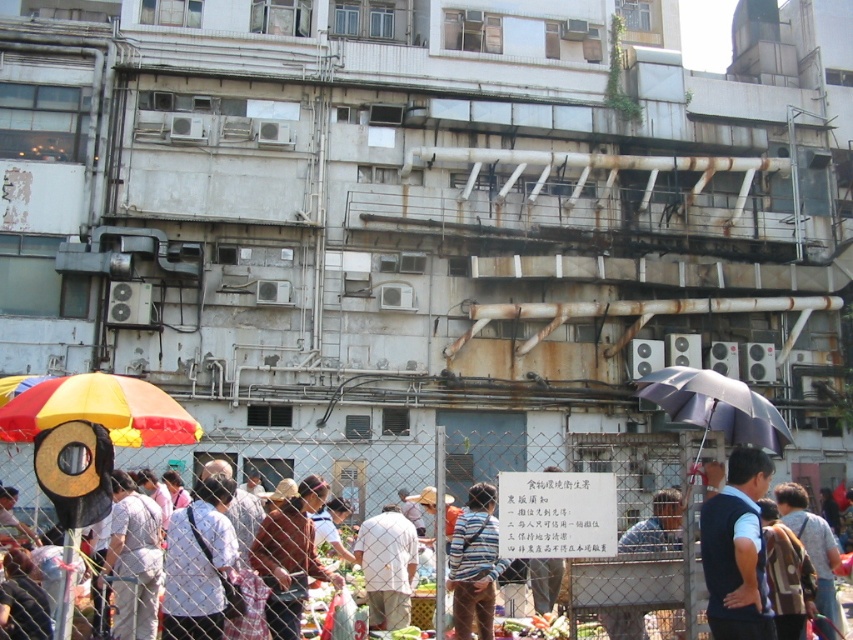
Can you confirm if striped shirt at center is smaller than blue denim shirt at center?

Yes, striped shirt at center is smaller than blue denim shirt at center.

Between striped shirt at center and blue denim shirt at center, which one appears on the left side from the viewer's perspective?

From the viewer's perspective, striped shirt at center appears more on the left side.

Between point (466, 611) and point (631, 540), which one is positioned in front?

Point (631, 540) is in front.

Locate an element on the screen. This screenshot has height=640, width=853. striped shirt at center is located at coordinates (474, 563).

The height and width of the screenshot is (640, 853). Identify the location of metal chain-link fence at center. (576, 460).

Is metal chain-link fence at center above dark blue vest at center?

No.

Where is `metal chain-link fence at center`? Image resolution: width=853 pixels, height=640 pixels. metal chain-link fence at center is located at coordinates (576, 460).

Between dark purple fabric umbrella at right and blue denim shirt at center, which one is positioned lower?

blue denim shirt at center is below.

At what (x,y) coordinates should I click in order to perform the action: click on dark purple fabric umbrella at right. Please return your answer as a coordinate pair (x, y). This screenshot has height=640, width=853. Looking at the image, I should click on (717, 404).